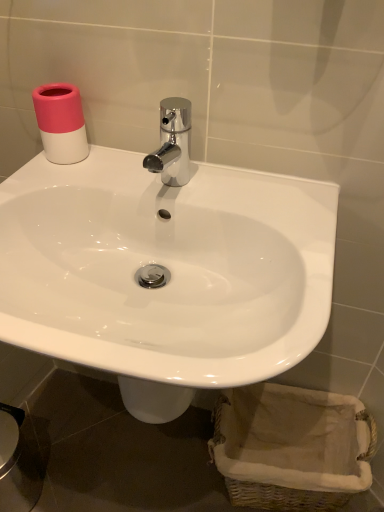
At what (x,y) coordinates should I click in order to perform the action: click on free space that is in between pink matte toilet paper at upper left and chrome metallic faucet at center. Please return your answer as a coordinate pair (x, y). The image size is (384, 512). Looking at the image, I should click on (115, 173).